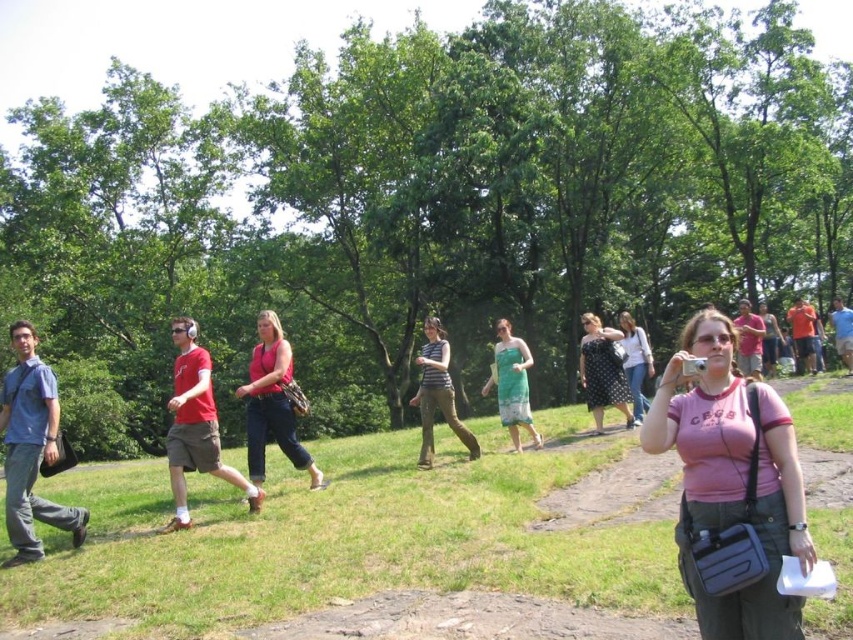
Question: Among these objects, which one is farthest from the camera?

Choices:
 (A) polka dot dress at center
 (B) green satin dress at center
 (C) striped fabric pants at center

Answer: (A)

Question: Which point is closer to the camera taking this photo?

Choices:
 (A) (173, 484)
 (B) (430, 380)

Answer: (A)

Question: Which of these objects is positioned farthest from the polka dot dress at center?

Choices:
 (A) green satin dress at center
 (B) green grass at center
 (C) black dotted dress at center
 (D) matte pink tank top at center

Answer: (D)

Question: Does matte red t-shirt at center come in front of black dotted dress at center?

Choices:
 (A) no
 (B) yes

Answer: (B)

Question: Is matte red t-shirt at center in front of black dotted dress at center?

Choices:
 (A) no
 (B) yes

Answer: (B)

Question: Can you confirm if matte red t-shirt at center is positioned to the left of striped fabric pants at center?

Choices:
 (A) yes
 (B) no

Answer: (A)